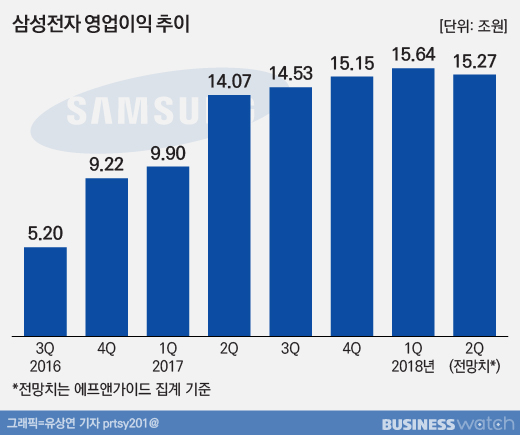
This screenshot has width=520, height=435. Identify the location of brackets. (440, 24), (504, 22).